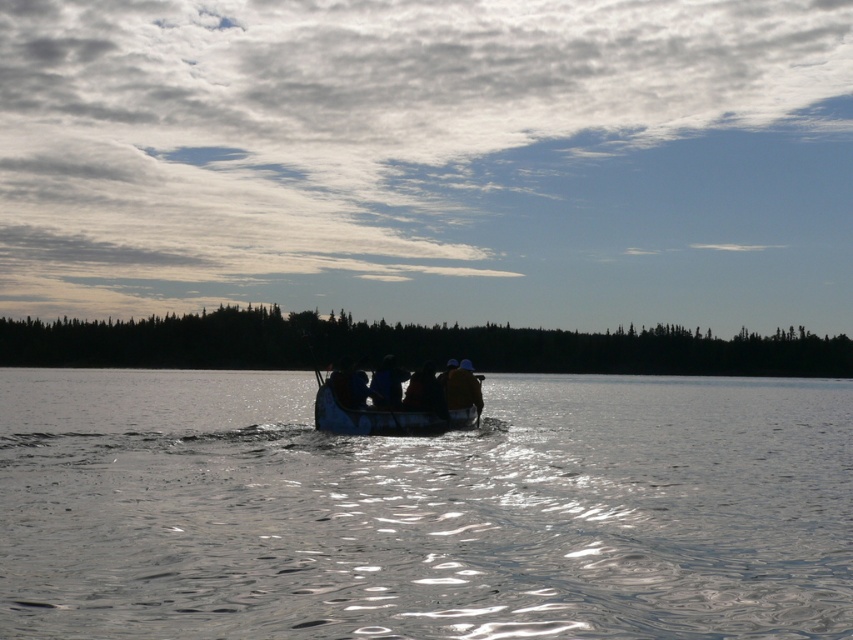
You are standing on the shore of the lake and see two points marked on the boat in the image. Which point, point (485, 589) or point (477, 403), is closer to you?

Point (485, 589) is closer to the viewer than point (477, 403).

You are a photographer trying to capture the scene from the shore. You notice the brown leather jacket at center and the blue fabric at center. Which object should you focus on if you want to capture the wider one?

The brown leather jacket at center might be wider than blue fabric at center, so focus on the brown leather jacket at center to capture the wider one.

You are standing on the shore and see the clear water at center and the brown wooden canoe at center. Which object is directly above the other?

The brown wooden canoe at center is directly above the clear water at center.